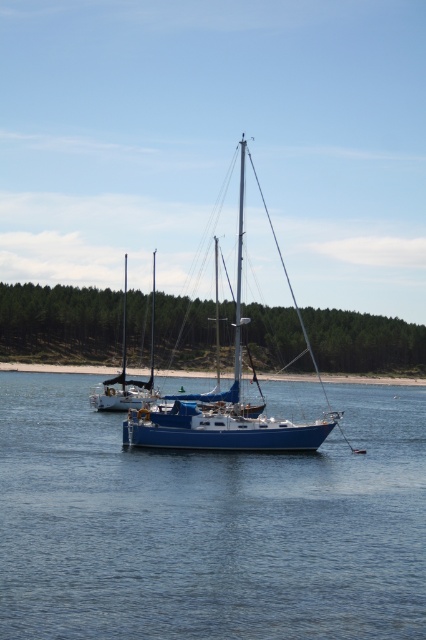
You are standing on the deck of the larger blue sailboat with a white cabin. You see a point marked at coordinates (209, 524). What is located at this point?

The point at coordinates (209, 524) is the location of blue water at center.

You are a sailor planning to anchor your boat in the area shown. You see the blue water at center and the blue matte sailboat at center. Which one is positioned higher from the water surface?

The blue matte sailboat at center is positioned higher from the water surface than the blue water at center, as the blue water at center is located below it.